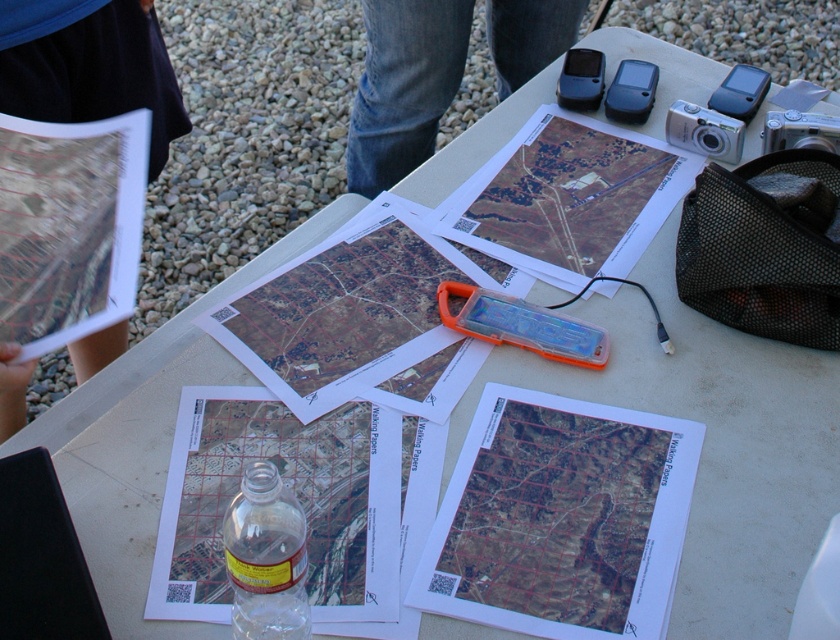
Question: Is matte paper map at center smaller than matte paper map at upper center?

Choices:
 (A) yes
 (B) no

Answer: (A)

Question: Which of the following is the closest to the observer?

Choices:
 (A) black fabric map at upper left
 (B) jeans at center
 (C) transparent paper map at lower left

Answer: (C)

Question: Which object appears farthest from the camera in this image?

Choices:
 (A) matte paper map at upper center
 (B) clear plastic bottle at center
 (C) translucent orange case at center

Answer: (A)

Question: Which object is farther from the camera taking this photo?

Choices:
 (A) matte paper map at upper center
 (B) black fabric map at upper left
 (C) clear plastic bottle at center
 (D) matte paper map at upper left

Answer: (A)

Question: Is matte paper map at upper center above jeans at center?

Choices:
 (A) no
 (B) yes

Answer: (A)

Question: Can you confirm if matte paper map at center is positioned above jeans at center?

Choices:
 (A) yes
 (B) no

Answer: (B)